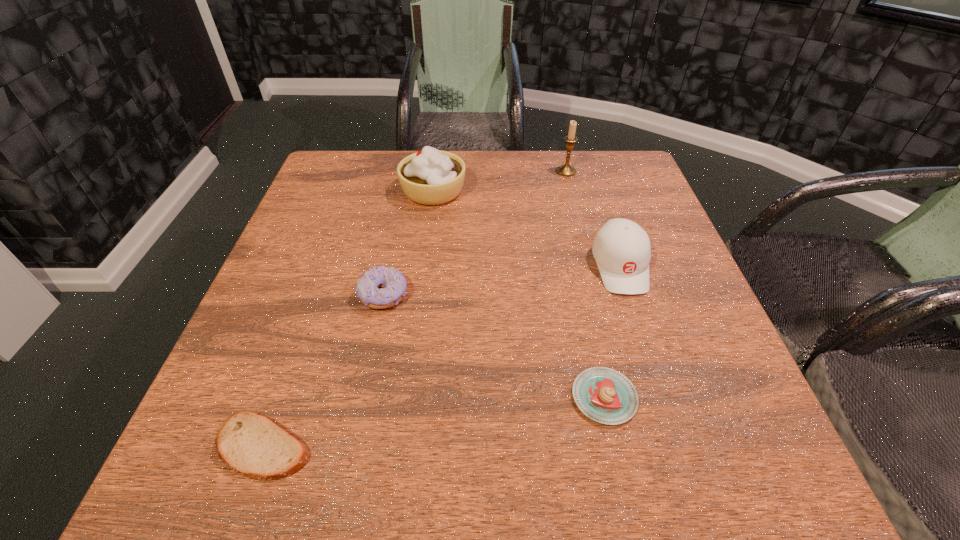
Locate an element on the screen. This screenshot has height=540, width=960. vacant space at the near edge of the desktop is located at coordinates (379, 447).

This screenshot has width=960, height=540. Identify the location of free space at the left edge. (255, 307).

Locate an element on the screen. vacant area at the right edge of the desktop is located at coordinates click(684, 395).

In the image, there is a desktop. Where is `vacant area at the far left corner`? The height and width of the screenshot is (540, 960). vacant area at the far left corner is located at coordinates (362, 185).

In the image, there is a desktop. Where is `vacant space at the far right corner`? vacant space at the far right corner is located at coordinates (622, 191).

At what (x,y) coordinates should I click in order to perform the action: click on free space that is in between the pita bread and the second tallest object. Please return your answer as a coordinate pair (x, y). The height and width of the screenshot is (540, 960). Looking at the image, I should click on (348, 319).

Locate an element on the screen. The height and width of the screenshot is (540, 960). free space between the candle holder and the whipped cream is located at coordinates (499, 181).

Locate an element on the screen. This screenshot has width=960, height=540. empty space that is in between the candle holder and the doughnut is located at coordinates (474, 233).

Find the location of a particular element. This screenshot has height=540, width=960. empty space between the leftmost object and the fourth shortest object is located at coordinates (442, 356).

Identify the location of free area in between the third shortest object and the fifth tallest object. [x=493, y=346].